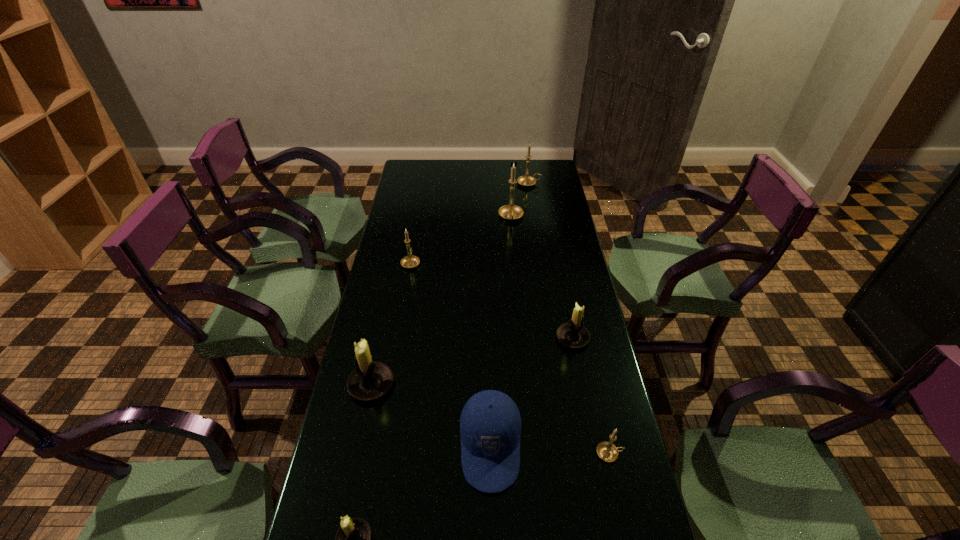
This screenshot has width=960, height=540. What are the coordinates of `free point between the cap and the second nearest gold candle holder` in the screenshot? It's located at (450, 355).

At what (x,y) coordinates should I click in order to perform the action: click on vacant region between the blue cap and the rightmost gold candle holder. Please return your answer as a coordinate pair (x, y). Image resolution: width=960 pixels, height=540 pixels. Looking at the image, I should click on (550, 450).

The height and width of the screenshot is (540, 960). I want to click on free spot between the sixth nearest object and the second farthest gold candle holder, so click(461, 240).

I want to click on the sixth closest object to the second farthest white candle holder, so click(x=510, y=212).

Locate an element on the screen. The width and height of the screenshot is (960, 540). the third closest object to the fourth farthest object is located at coordinates (370, 380).

Locate which candle holder is the fifth closest to the blue cap. Please provide its 2D coordinates. Your answer should be formatted as a tuple, i.e. [(x, y)], where the tuple contains the x and y coordinates of a point satisfying the conditions above.

[(410, 261)]

The image size is (960, 540). I want to click on candle holder that can be found as the fifth closest to the farthest candle holder, so click(606, 451).

Choose which gold candle holder is the nearest neighbor to the cap. Please provide its 2D coordinates. Your answer should be formatted as a tuple, i.e. [(x, y)], where the tuple contains the x and y coordinates of a point satisfying the conditions above.

[(606, 451)]

Where is `gold candle holder that is the third closest to the cap`? gold candle holder that is the third closest to the cap is located at coordinates (510, 212).

Locate which white candle holder ranks third in proximity to the fifth nearest candle holder. Please provide its 2D coordinates. Your answer should be formatted as a tuple, i.e. [(x, y)], where the tuple contains the x and y coordinates of a point satisfying the conditions above.

[(353, 539)]